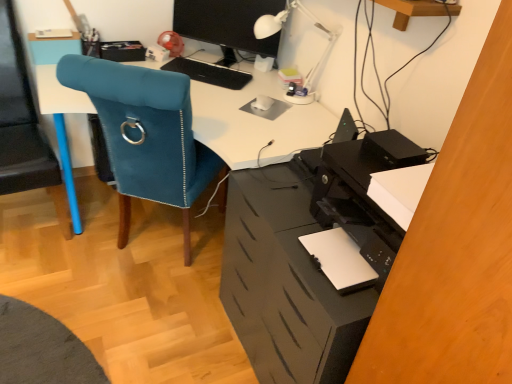
Question: From the image's perspective, is white plastic table lamp at upper center positioned above or below blue fabric chair at left?

Choices:
 (A) above
 (B) below

Answer: (A)

Question: Is white plastic table lamp at upper center inside the boundaries of blue fabric chair at left, or outside?

Choices:
 (A) outside
 (B) inside

Answer: (A)

Question: Based on their relative distances, which object is farther from the black matte file cabinet at lower right?

Choices:
 (A) blue fabric chair at left
 (B) white plastic table lamp at upper center
 (C) black matte keyboard at center
 (D) velvet blue chair at left
 (E) matte black monitor at upper center

Answer: (A)

Question: Estimate the real-world distances between objects in this image. Which object is farther from the velvet blue chair at left?

Choices:
 (A) black matte keyboard at center
 (B) blue fabric chair at left
 (C) black matte file cabinet at lower right
 (D) white plastic table lamp at upper center
 (E) matte black monitor at upper center

Answer: (E)